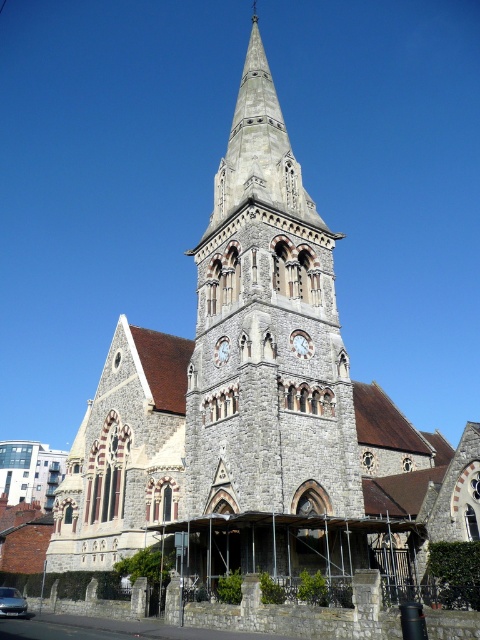
Does gray stone tower at center come behind white marble clock at center?

No, gray stone tower at center is closer to the viewer.

Looking at this image, who is taller, gray stone tower at center or white marble clock at center?

gray stone tower at center

The image size is (480, 640). In order to click on gray stone tower at center in this screenshot , I will do `click(266, 336)`.

Does point (296, 339) come in front of point (218, 362)?

That is True.

Between white marble clock at center and light gray stone clock at center, which one appears on the right side from the viewer's perspective?

Positioned to the right is white marble clock at center.

Between point (309, 340) and point (216, 356), which one is positioned in front?

Point (309, 340) is in front.

At what (x,y) coordinates should I click in order to perform the action: click on white marble clock at center. Please return your answer as a coordinate pair (x, y). This screenshot has height=640, width=480. Looking at the image, I should click on (300, 342).

In the scene shown: Which of these two, gray stone tower at center or light gray stone clock at center, stands taller?

Standing taller between the two is gray stone tower at center.

Between point (233, 410) and point (219, 349), which one is positioned behind?

Point (219, 349)

Locate an element on the screen. gray stone tower at center is located at coordinates (266, 336).